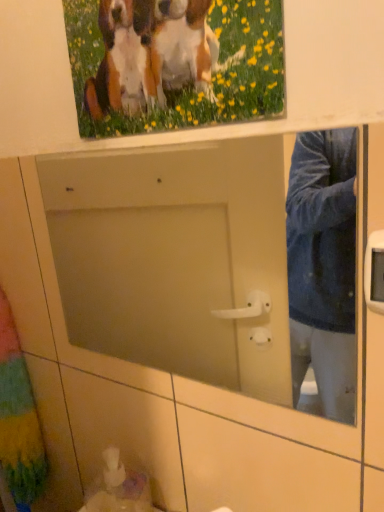
This screenshot has width=384, height=512. Describe the element at coordinates (118, 488) in the screenshot. I see `white glossy sink at lower left` at that location.

I want to click on white glossy sink at lower left, so click(x=118, y=488).

This screenshot has width=384, height=512. Identify the location of white glossy sink at lower left. (118, 488).

The height and width of the screenshot is (512, 384). Find the location of `picture frame above the white glossy sink at lower left (from the image's perspective)`. picture frame above the white glossy sink at lower left (from the image's perspective) is located at coordinates (174, 63).

From a real-world perspective, who is located higher, wooden picture frame at upper center or white glossy sink at lower left?

From a 3D spatial view, wooden picture frame at upper center is above.

Relative to white glossy sink at lower left, is wooden picture frame at upper center in front or behind?

Visually, wooden picture frame at upper center is located in front of white glossy sink at lower left.

Is wooden picture frame at upper center taller than white glossy sink at lower left?

Correct, wooden picture frame at upper center is much taller as white glossy sink at lower left.

Between white glossy sink at lower left and wooden picture frame at upper center, which one has more height?

wooden picture frame at upper center is taller.

Does white glossy sink at lower left turn towards wooden picture frame at upper center?

No, white glossy sink at lower left is not oriented towards wooden picture frame at upper center.

In terms of size, does white glossy sink at lower left appear bigger or smaller than wooden picture frame at upper center?

Considering their sizes, white glossy sink at lower left takes up less space than wooden picture frame at upper center.

Is there a large distance between multicolored fabric curtain at left and white glossy sink at lower left?

No, multicolored fabric curtain at left is in close proximity to white glossy sink at lower left.

Does multicolored fabric curtain at left have a lesser height compared to white glossy sink at lower left?

In fact, multicolored fabric curtain at left may be taller than white glossy sink at lower left.

Is multicolored fabric curtain at left positioned with its back to white glossy sink at lower left?

No, multicolored fabric curtain at left's orientation is not away from white glossy sink at lower left.

Which is closer, (x=0, y=296) or (x=120, y=466)?

Point (x=0, y=296) is farther from the camera than point (x=120, y=466).

Locate an element on the screen. picture frame above the multicolored fabric curtain at left (from the image's perspective) is located at coordinates (174, 63).

In the scene shown: From a real-world perspective, is multicolored fabric curtain at left beneath wooden picture frame at upper center?

Yes.

From the image's perspective, which object appears higher, multicolored fabric curtain at left or wooden picture frame at upper center?

Answer: wooden picture frame at upper center, from the image's perspective.

Choose the correct answer: Is multicolored fabric curtain at left inside wooden picture frame at upper center or outside it?

multicolored fabric curtain at left exists outside the volume of wooden picture frame at upper center.

Is white glossy sink at lower left taller than multicolored fabric curtain at left?

No.

Can you confirm if white glossy sink at lower left is wider than multicolored fabric curtain at left?

No.

In the scene shown: From a real-world perspective, is white glossy sink at lower left positioned above or below multicolored fabric curtain at left?

From a real-world perspective, white glossy sink at lower left is physically below multicolored fabric curtain at left.

Is wooden picture frame at upper center to the right of multicolored fabric curtain at left from the viewer's perspective?

Indeed, wooden picture frame at upper center is positioned on the right side of multicolored fabric curtain at left.

At what (x,y) coordinates should I click in order to perform the action: click on picture frame above the multicolored fabric curtain at left (from the image's perspective). Please return your answer as a coordinate pair (x, y). The image size is (384, 512). Looking at the image, I should click on (174, 63).

From the image's perspective, is wooden picture frame at upper center located above or below multicolored fabric curtain at left?

From the image's perspective, wooden picture frame at upper center appears above multicolored fabric curtain at left.

Between wooden picture frame at upper center and multicolored fabric curtain at left, which one has more height?

Standing taller between the two is multicolored fabric curtain at left.

I want to click on sink lying below the wooden picture frame at upper center (from the image's perspective), so click(x=118, y=488).

In the image, there is a white glossy sink at lower left. Where is `picture frame above it (from the image's perspective)`? Image resolution: width=384 pixels, height=512 pixels. picture frame above it (from the image's perspective) is located at coordinates click(174, 63).

From the image, which object appears to be farther from multicolored fabric curtain at left, wooden picture frame at upper center or white glossy sink at lower left?

Among the two, wooden picture frame at upper center is located further to multicolored fabric curtain at left.

Considering their positions, is multicolored fabric curtain at left positioned closer to wooden picture frame at upper center than white glossy sink at lower left?

white glossy sink at lower left lies closer to wooden picture frame at upper center than the other object.

Estimate the real-world distances between objects in this image. Which object is further from white glossy sink at lower left, multicolored fabric curtain at left or wooden picture frame at upper center?

Based on the image, wooden picture frame at upper center appears to be further to white glossy sink at lower left.

Based on their spatial positions, is wooden picture frame at upper center or multicolored fabric curtain at left further from white glossy sink at lower left?

wooden picture frame at upper center lies further to white glossy sink at lower left than the other object.

Which object lies nearer to the anchor point multicolored fabric curtain at left, white glossy sink at lower left or wooden picture frame at upper center?

The object closer to multicolored fabric curtain at left is white glossy sink at lower left.

From the picture: Based on their spatial positions, is white glossy sink at lower left or multicolored fabric curtain at left further from wooden picture frame at upper center?

The object further to wooden picture frame at upper center is multicolored fabric curtain at left.

This screenshot has width=384, height=512. Find the location of `curtain between wooden picture frame at upper center and white glossy sink at lower left in the up-down direction`. curtain between wooden picture frame at upper center and white glossy sink at lower left in the up-down direction is located at coordinates (18, 418).